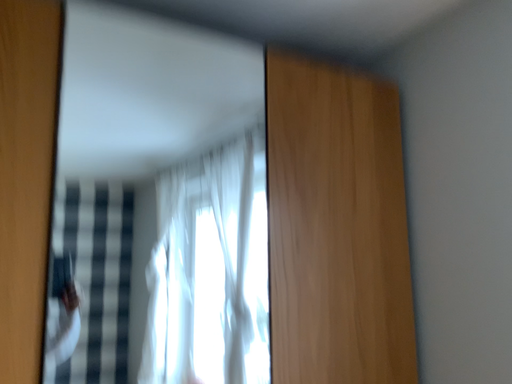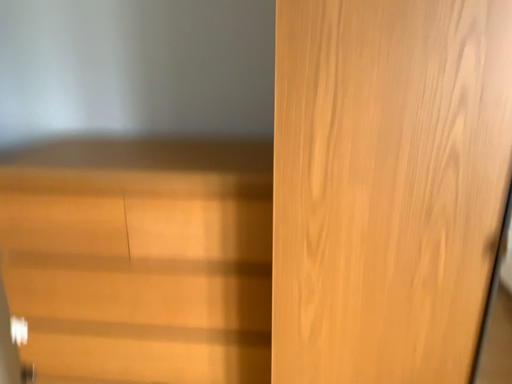
Question: Which way did the camera rotate in the video?

Choices:
 (A) rotated downward
 (B) rotated upward

Answer: (A)